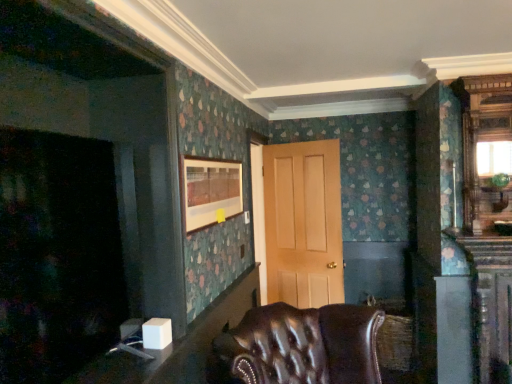
I want to click on free point above white glossy table at lower left, the 2th table in the bottom-to-top sequence (from a real-world perspective), so click(120, 351).